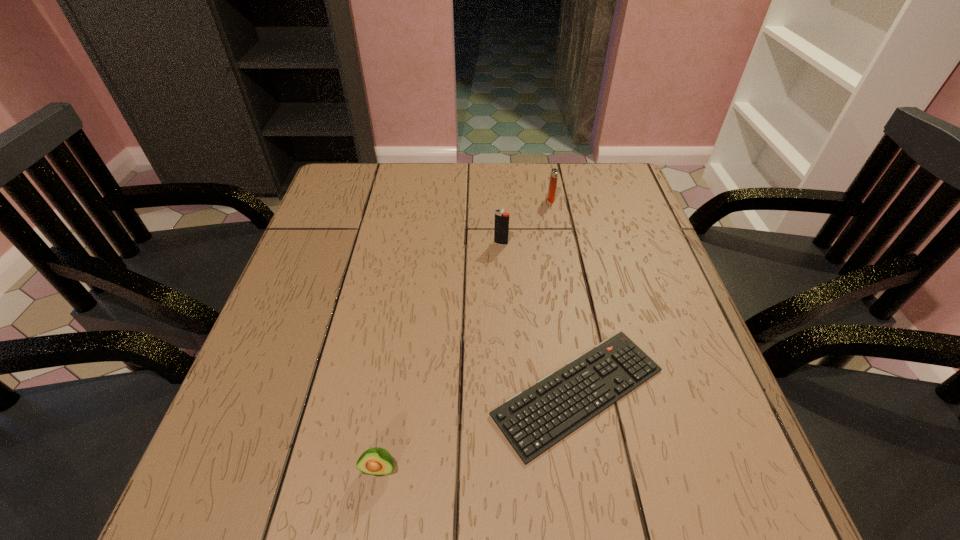
Identify the location of free space between the third nearest object and the third tallest object. (440, 356).

You are a GUI agent. You are given a task and a screenshot of the screen. Output one action in this format:
    pyautogui.click(x=<x>, y=<y>)
    Task: Click on the vacant area that lies between the computer keyboard and the leftmost object
    This screenshot has width=960, height=540.
    Given the screenshot: What is the action you would take?
    pyautogui.click(x=479, y=430)

Where is `object that is the third nearest to the computer keyboard`? This screenshot has height=540, width=960. object that is the third nearest to the computer keyboard is located at coordinates (554, 172).

Where is `the third closest object to the third nearest object`? the third closest object to the third nearest object is located at coordinates [376, 461].

You are a GUI agent. You are given a task and a screenshot of the screen. Output one action in this format:
    pyautogui.click(x=<x>, y=<y>)
    Task: Click on the free region that satisfies the following two spatial constraints: 1. on the back side of the farther igniter; 2. on the right side of the second farthest object
    This screenshot has width=960, height=540.
    Given the screenshot: What is the action you would take?
    pyautogui.click(x=498, y=199)